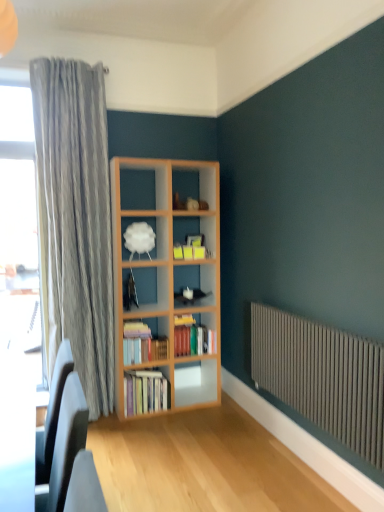
Find the location of `empty space that is ontop of hardcover books at center, placed as the second book when sorted from bottom to top (from a real-world perspective)`. empty space that is ontop of hardcover books at center, placed as the second book when sorted from bottom to top (from a real-world perspective) is located at coordinates tap(140, 320).